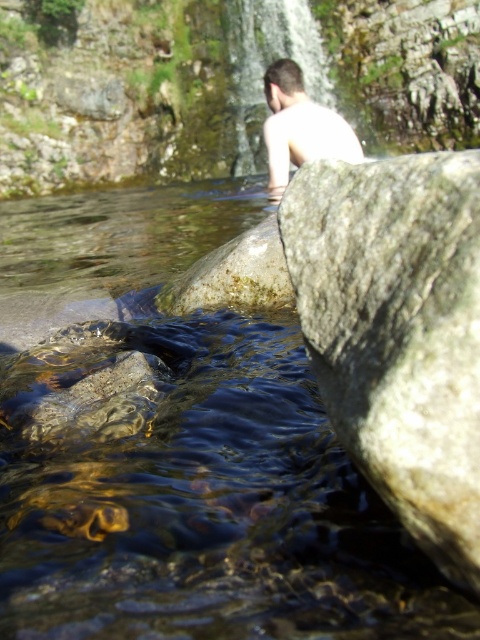
Based on the photo, can you confirm if transparent water at center is positioned to the left of light skin human at center?

Yes, transparent water at center is to the left of light skin human at center.

Does transparent water at center have a larger size compared to light skin human at center?

Indeed, transparent water at center has a larger size compared to light skin human at center.

Between point (230, 582) and point (276, 108), which one is positioned behind?

The point (276, 108) is behind.

Find the location of a particular element. The height and width of the screenshot is (640, 480). transparent water at center is located at coordinates pyautogui.click(x=180, y=449).